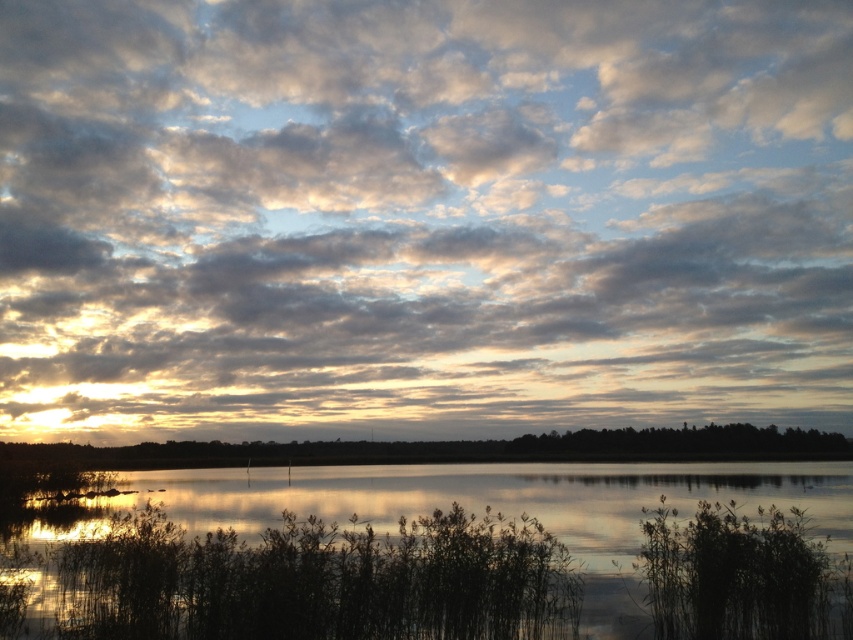
Question: Is cloudy sky at upper center above silvery reflective water at center?

Choices:
 (A) no
 (B) yes

Answer: (B)

Question: Among these points, which one is farthest from the camera?

Choices:
 (A) (175, 160)
 (B) (531, 440)
 (C) (619, 502)

Answer: (A)

Question: Which of the following is the farthest from the observer?

Choices:
 (A) cloudy sky at upper center
 (B) silvery reflective water at center

Answer: (A)

Question: From the image, what is the correct spatial relationship of cloudy sky at upper center in relation to silvery reflective water at center?

Choices:
 (A) left
 (B) right

Answer: (A)

Question: Which point is closer to the camera?

Choices:
 (A) (331, 449)
 (B) (436, 499)
 (C) (38, 332)

Answer: (B)

Question: Can you confirm if cloudy sky at upper center is positioned to the right of silvery reflective water at center?

Choices:
 (A) no
 (B) yes

Answer: (A)